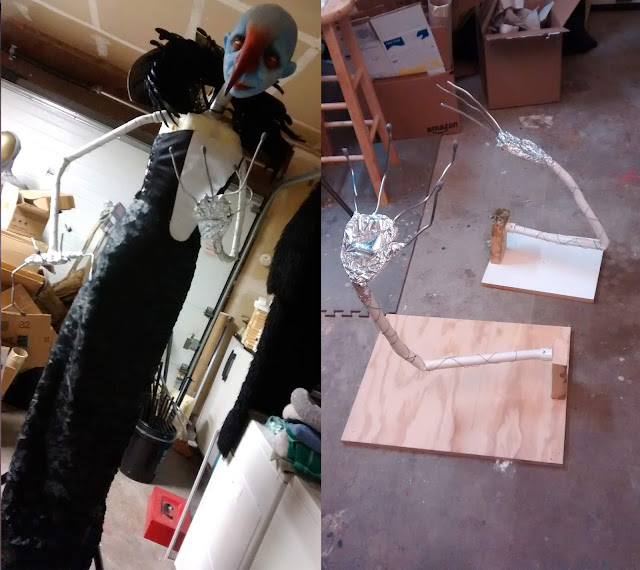
Where is `floor`? The height and width of the screenshot is (570, 640). floor is located at coordinates (527, 194).